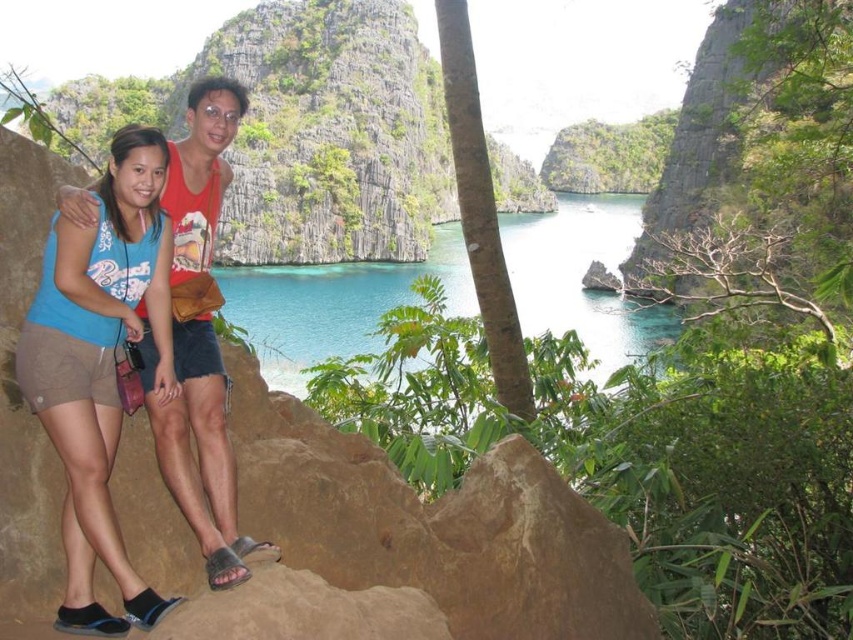
Is blue fabric shorts at lower left shorter than clear blue water at center?

Indeed, blue fabric shorts at lower left has a lesser height compared to clear blue water at center.

Can you confirm if blue fabric shorts at lower left is bigger than clear blue water at center?

No, blue fabric shorts at lower left is not bigger than clear blue water at center.

Find the location of a particular element. The image size is (853, 640). blue fabric shorts at lower left is located at coordinates [x=100, y=364].

Between blue fabric shorts at lower left and matte red tank top at center, which one has less height?

Standing shorter between the two is blue fabric shorts at lower left.

Can you confirm if blue fabric shorts at lower left is positioned below matte red tank top at center?

Yes.

Where is `blue fabric shorts at lower left`? The width and height of the screenshot is (853, 640). blue fabric shorts at lower left is located at coordinates (100, 364).

Is point (299, 282) closer to viewer compared to point (206, 289)?

No, it is behind (206, 289).

Measure the distance between clear blue water at center and camera.

32.59 meters

At what (x,y) coordinates should I click in order to perform the action: click on clear blue water at center. Please return your answer as a coordinate pair (x, y). This screenshot has height=640, width=853. Looking at the image, I should click on (335, 305).